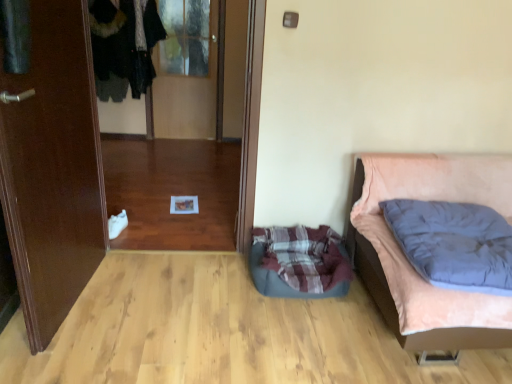
Question: From the image's perspective, is transparent glass door at center, placed as the 2th glass door when sorted from top to bottom, on velvet-like black coat at upper left?

Choices:
 (A) yes
 (B) no

Answer: (B)

Question: Is transparent glass door at center, placed as the 2th glass door when sorted from top to bottom, not within velvet-like black coat at upper left?

Choices:
 (A) no
 (B) yes

Answer: (B)

Question: From the image's perspective, is transparent glass door at center, placed as the 2th glass door when sorted from top to bottom, located beneath velvet-like black coat at upper left?

Choices:
 (A) yes
 (B) no

Answer: (A)

Question: Is there a large distance between transparent glass door at center, placed as the 2th glass door when sorted from top to bottom, and velvet-like black coat at upper left?

Choices:
 (A) yes
 (B) no

Answer: (A)

Question: Considering the relative sizes of transparent glass door at center, placed as the 2th glass door when sorted from top to bottom, and velvet-like black coat at upper left in the image provided, is transparent glass door at center, placed as the 2th glass door when sorted from top to bottom, smaller than velvet-like black coat at upper left?

Choices:
 (A) no
 (B) yes

Answer: (B)

Question: Can you confirm if transparent glass door at center, which appears as the first glass door when viewed from the front, is bigger than velvet-like black coat at upper left?

Choices:
 (A) yes
 (B) no

Answer: (B)

Question: Is transparent glass door at upper center, which is the second glass door in bottom-to-top order, oriented away from velvet-like black coat at upper left?

Choices:
 (A) no
 (B) yes

Answer: (A)

Question: Considering the relative positions of transparent glass door at upper center, the 2th glass door in the front-to-back sequence, and velvet-like black coat at upper left in the image provided, is transparent glass door at upper center, the 2th glass door in the front-to-back sequence, to the right of velvet-like black coat at upper left from the viewer's perspective?

Choices:
 (A) yes
 (B) no

Answer: (A)

Question: Can you confirm if transparent glass door at upper center, the first glass door viewed from the top, is smaller than velvet-like black coat at upper left?

Choices:
 (A) no
 (B) yes

Answer: (B)

Question: Is transparent glass door at upper center, the first glass door viewed from the top, not near velvet-like black coat at upper left?

Choices:
 (A) yes
 (B) no

Answer: (B)

Question: Is velvet-like black coat at upper left a part of transparent glass door at upper center, the 1th glass door viewed from the back?

Choices:
 (A) no
 (B) yes

Answer: (A)

Question: Can you confirm if transparent glass door at upper center, the 2th glass door in the front-to-back sequence, is wider than velvet-like black coat at upper left?

Choices:
 (A) yes
 (B) no

Answer: (B)

Question: Considering the relative sizes of plaid fabric dog bed at lower center and velvet-like black coat at upper left in the image provided, is plaid fabric dog bed at lower center smaller than velvet-like black coat at upper left?

Choices:
 (A) yes
 (B) no

Answer: (A)